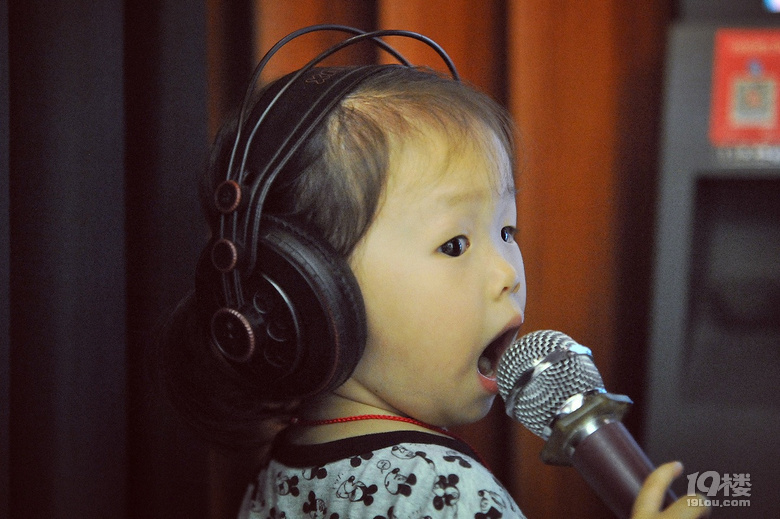
This screenshot has height=519, width=780. What are the coordinates of `shelf` in the screenshot? It's located at (675, 197).